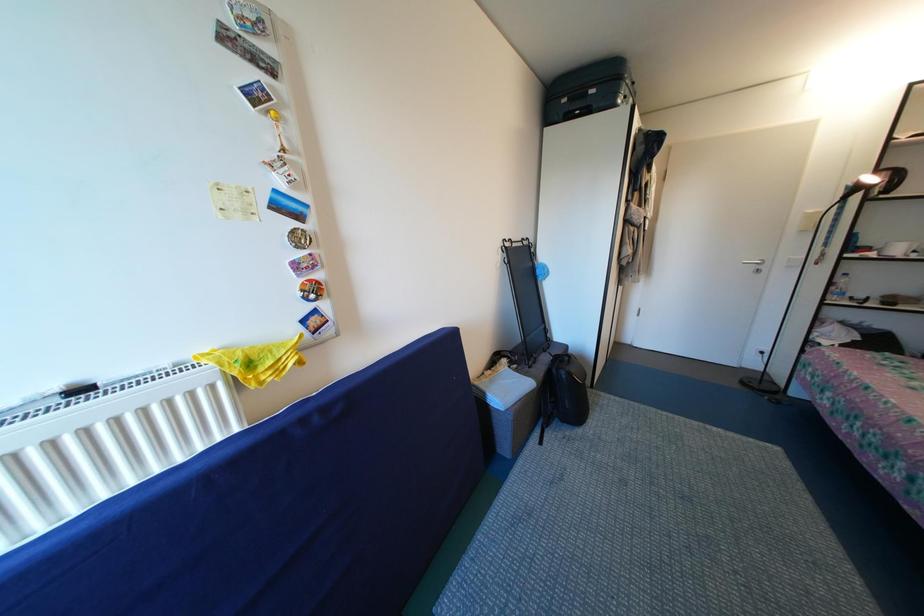
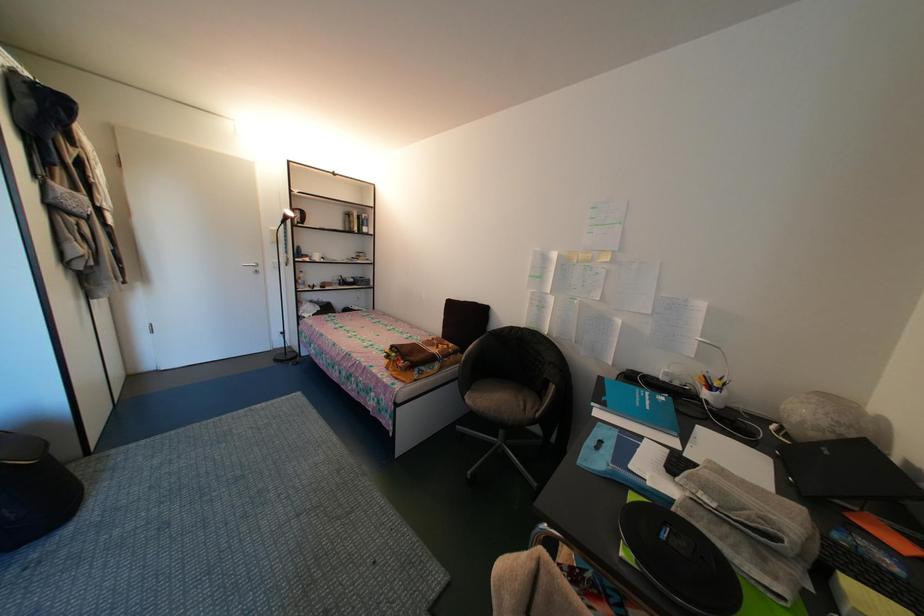
Question: The camera is either moving clockwise (left) or counter-clockwise (right) around the object. The first image is from the beginning of the video and the second image is from the end. Is the camera moving left or right when shooting the video?

Choices:
 (A) Left
 (B) Right

Answer: (A)